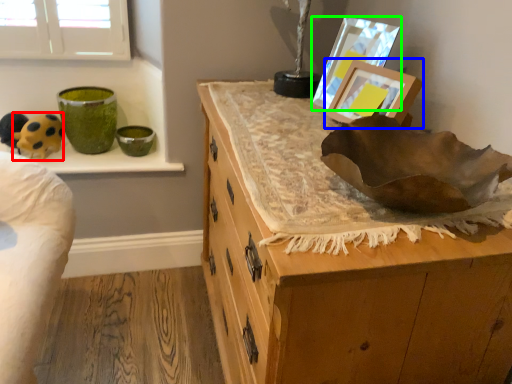
Question: Which object is positioned closest to animal (highlighted by a red box)? Select from picture frame (highlighted by a blue box) and picture frame (highlighted by a green box).

Choices:
 (A) picture frame
 (B) picture frame

Answer: (B)